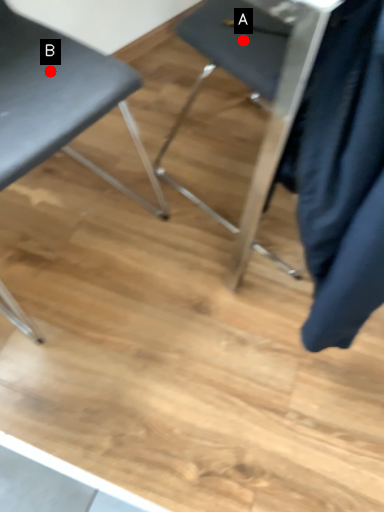
Question: Two points are circled on the image, labeled by A and B beside each circle. Which point appears closest to the camera in this image?

Choices:
 (A) A is closer
 (B) B is closer

Answer: (B)